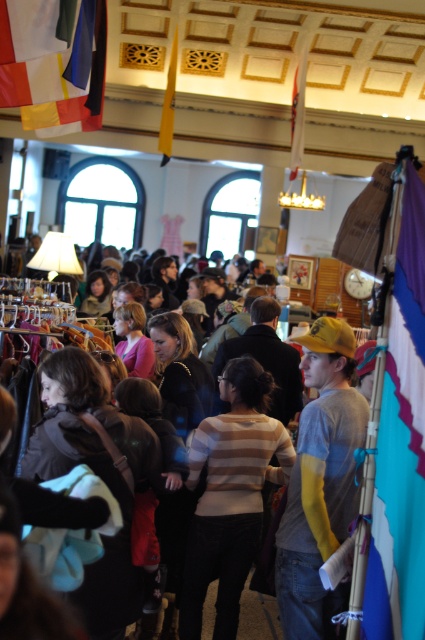
You are a vendor at the flea market and want to hang a new banner between the blue fabric flag at right and the white fabric flag at upper left. Which flag is smaller so you know where to place the banner appropriately?

The blue fabric flag at right is smaller compared to the white fabric flag at upper left, so you should place the banner accordingly to account for the size difference.

You are a photographer standing in the middle of the market. You want to take a photo that includes both the blue fabric flag at right and the white fabric flag at upper left. Which flag should you adjust your position to focus on first to ensure both are in frame?

You should focus on the blue fabric flag at right first because it is closer to you than the white fabric flag at upper left, so adjusting your position to include it will naturally bring the distant white fabric flag at upper left into the frame as well.